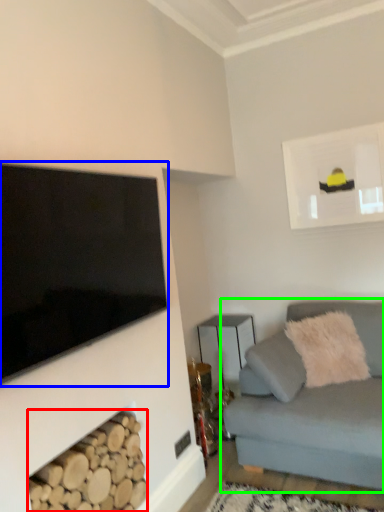
Question: Which is nearer to the wood (highlighted by a red box)? television (highlighted by a blue box) or studio couch (highlighted by a green box).

Choices:
 (A) television
 (B) studio couch

Answer: (A)